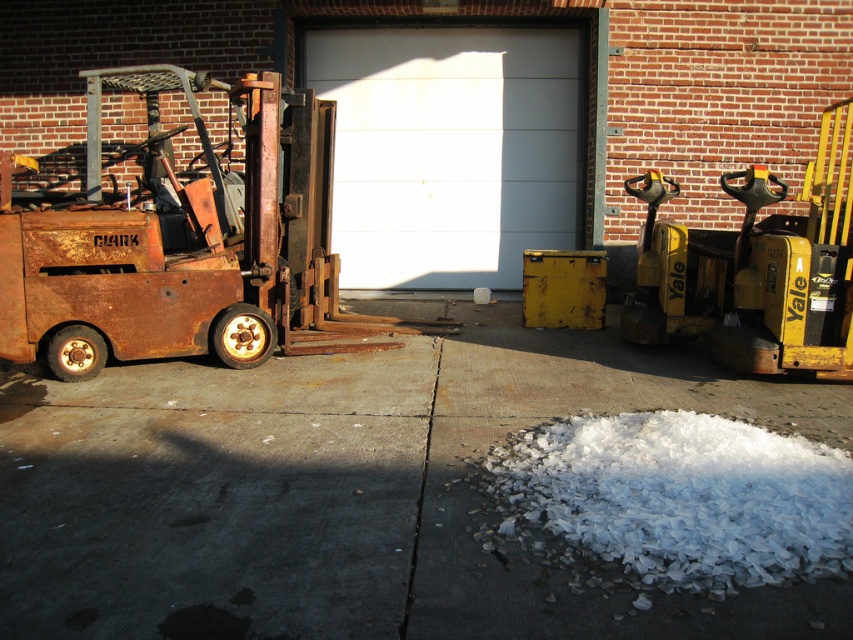
Question: Does rusty metal forklift at left lie in front of white smooth garage door at center?

Choices:
 (A) yes
 (B) no

Answer: (A)

Question: Among these objects, which one is farthest from the camera?

Choices:
 (A) white flaky snow at lower center
 (B) rusty metal forklift at left

Answer: (B)

Question: Which point is farther from the camera taking this photo?

Choices:
 (A) (282, 170)
 (B) (733, 460)

Answer: (A)

Question: Can you confirm if concrete pavement at center is positioned to the right of rusty metal forklift at left?

Choices:
 (A) no
 (B) yes

Answer: (B)

Question: Based on their relative distances, which object is nearer to the rusty metal forklift at left?

Choices:
 (A) white smooth garage door at center
 (B) white flaky snow at lower center

Answer: (A)

Question: Can you confirm if concrete pavement at center is wider than white flaky snow at lower center?

Choices:
 (A) no
 (B) yes

Answer: (B)